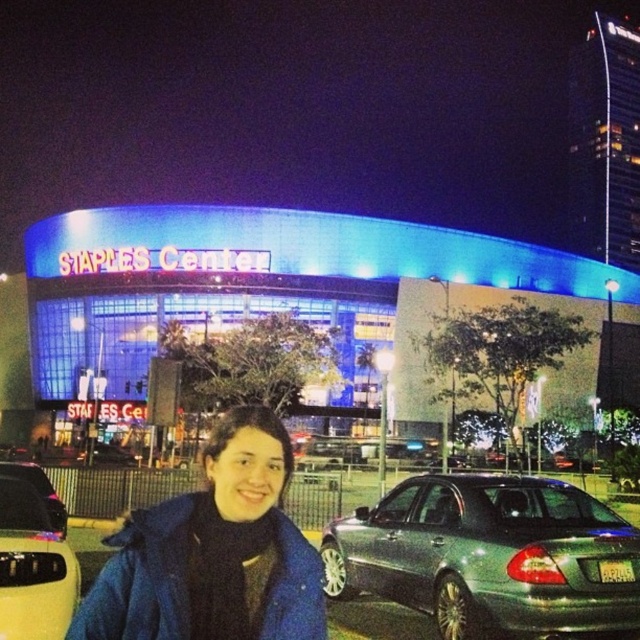
Is blue fleece jacket at center bigger than metallic silver sedan at lower left?

Yes, blue fleece jacket at center is bigger than metallic silver sedan at lower left.

Can you confirm if blue fleece jacket at center is positioned to the left of metallic silver sedan at lower left?

In fact, blue fleece jacket at center is to the right of metallic silver sedan at lower left.

Locate an element on the screen. The height and width of the screenshot is (640, 640). blue fleece jacket at center is located at coordinates (212, 552).

Which of these two, metallic silver sedan at center or blue fleece jacket at center, stands shorter?

metallic silver sedan at center is shorter.

Can you confirm if metallic silver sedan at center is positioned to the right of blue fleece jacket at center?

Indeed, metallic silver sedan at center is positioned on the right side of blue fleece jacket at center.

Locate an element on the screen. metallic silver sedan at center is located at coordinates (490, 556).

Between metallic silver sedan at center and metallic silver sedan at lower left, which one appears on the left side from the viewer's perspective?

From the viewer's perspective, metallic silver sedan at lower left appears more on the left side.

The height and width of the screenshot is (640, 640). I want to click on metallic silver sedan at center, so click(x=490, y=556).